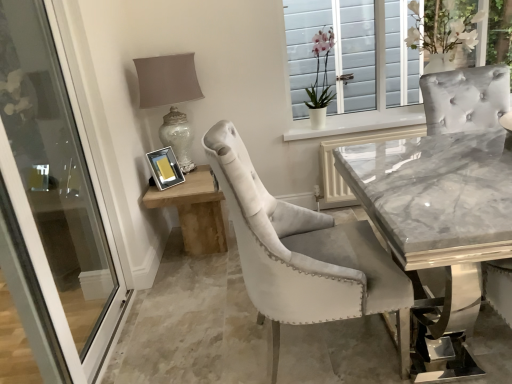
Question: In terms of width, does metallic silver picture frame at upper center look wider or thinner when compared to pink velvet orchid at upper center?

Choices:
 (A) thin
 (B) wide

Answer: (A)

Question: Does point (156, 165) appear closer or farther from the camera than point (315, 66)?

Choices:
 (A) closer
 (B) farther

Answer: (A)

Question: Which of these objects is positioned closest to the white marble shutter at upper right?

Choices:
 (A) matte silver table lamp at upper left
 (B) wooden side table at lower left
 (C) white glass door at left
 (D) pink velvet orchid at upper center
 (E) velvet chair at center

Answer: (D)

Question: Considering the real-world distances, which object is farthest from the matte silver table lamp at upper left?

Choices:
 (A) pink velvet orchid at upper center
 (B) metallic silver picture frame at upper center
 (C) wooden side table at lower left
 (D) white glass door at left
 (E) velvet chair at center

Answer: (E)